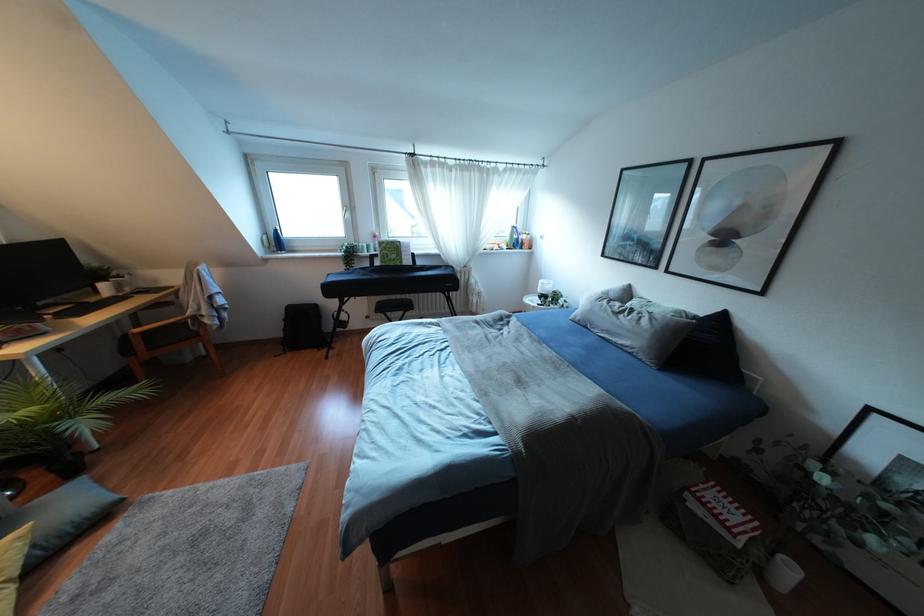
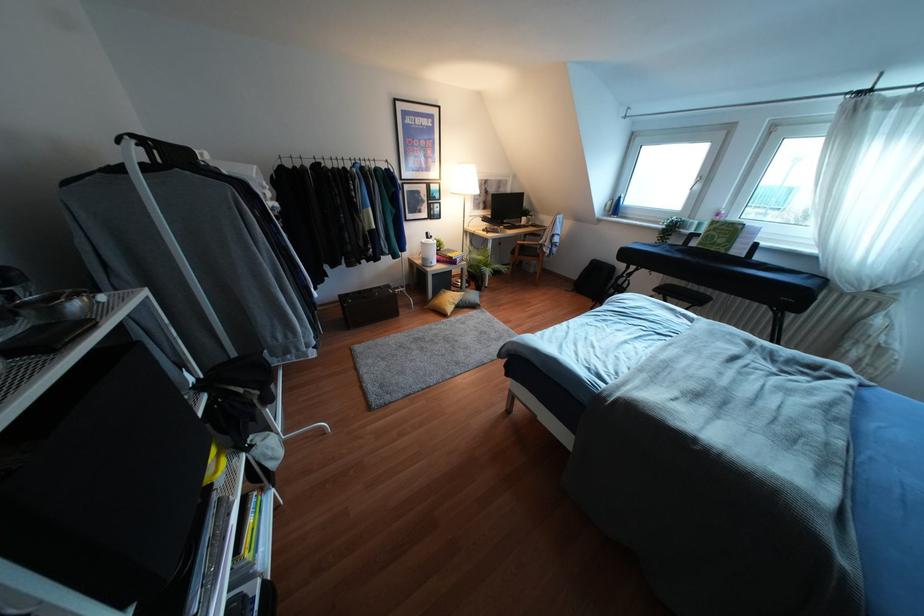
In the second image, find the point that corresponds to the point at 385,254 in the first image.

(712, 236)